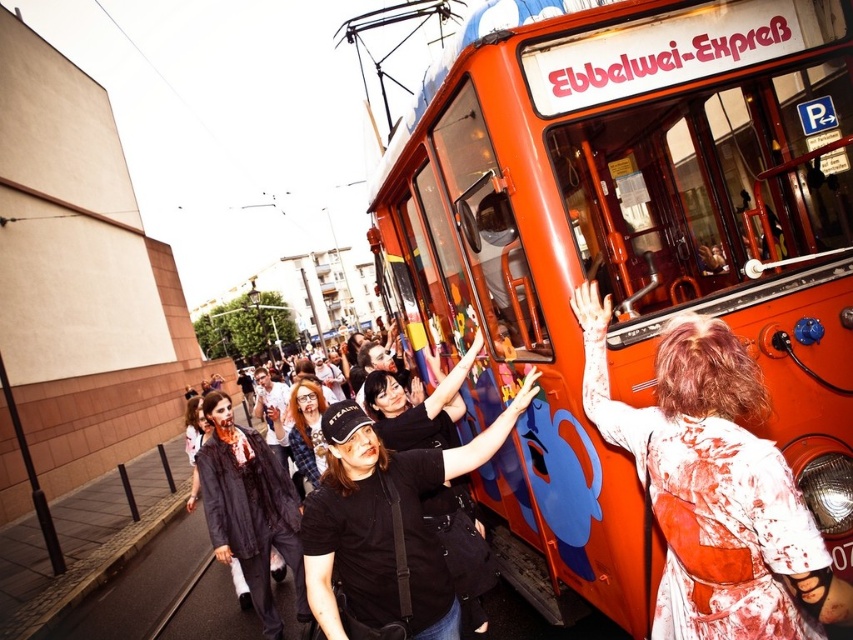
Question: Can you confirm if orange painted metal tram at center is positioned to the left of plaid fabric shirt at center?

Choices:
 (A) yes
 (B) no

Answer: (B)

Question: Does orange painted metal tram at center have a smaller size compared to plaid fabric shirt at center?

Choices:
 (A) yes
 (B) no

Answer: (B)

Question: Which object appears closest to the camera in this image?

Choices:
 (A) plaid fabric shirt at center
 (B) orange painted metal tram at center

Answer: (B)

Question: Can you confirm if orange painted metal tram at center is positioned above plaid fabric shirt at center?

Choices:
 (A) no
 (B) yes

Answer: (B)